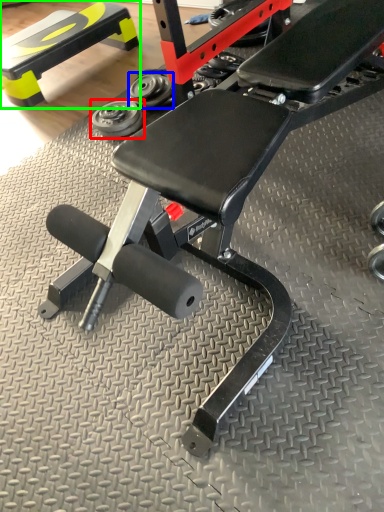
Question: Estimate the real-world distances between objects in this image. Which object is farther from dumbbell (highlighted by a red box), dumbbell (highlighted by a blue box) or bench (highlighted by a green box)?

Choices:
 (A) dumbbell
 (B) bench

Answer: (B)